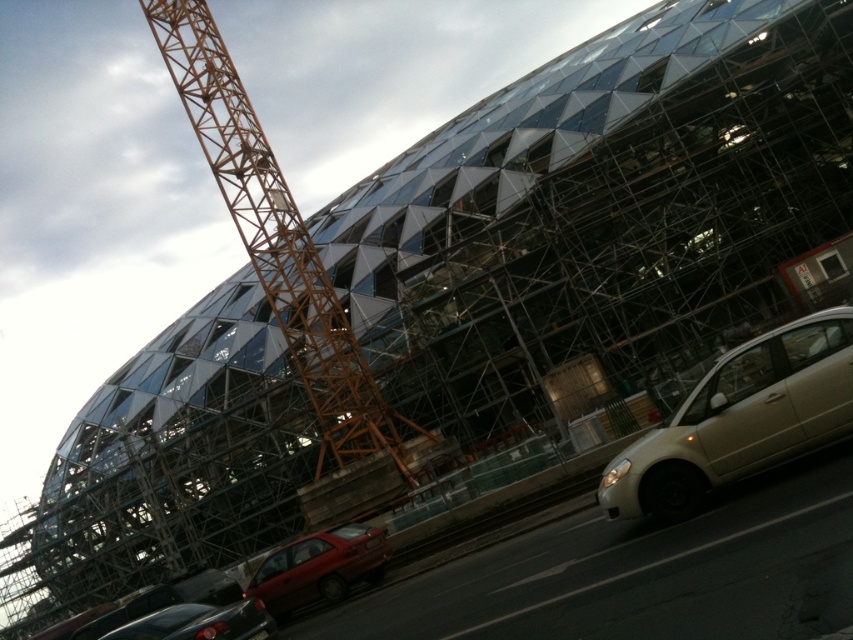
Can you confirm if shiny red sedan at lower left is smaller than shiny black sedan at lower left?

Yes, shiny red sedan at lower left is smaller than shiny black sedan at lower left.

Who is more forward, (328, 596) or (222, 605)?

Positioned in front is point (328, 596).

Is point (296, 557) closer to viewer compared to point (222, 630)?

No.

Identify the location of shiny red sedan at lower left. (318, 566).

Which of these two, satin beige sedan at right or shiny black sedan at lower left, stands shorter?

Standing shorter between the two is shiny black sedan at lower left.

Identify the location of satin beige sedan at right. (740, 419).

Does satin beige sedan at right appear over shiny red sedan at lower left?

Correct, satin beige sedan at right is located above shiny red sedan at lower left.

Can you confirm if satin beige sedan at right is positioned to the left of shiny red sedan at lower left?

Incorrect, satin beige sedan at right is not on the left side of shiny red sedan at lower left.

In order to click on satin beige sedan at right in this screenshot , I will do `click(740, 419)`.